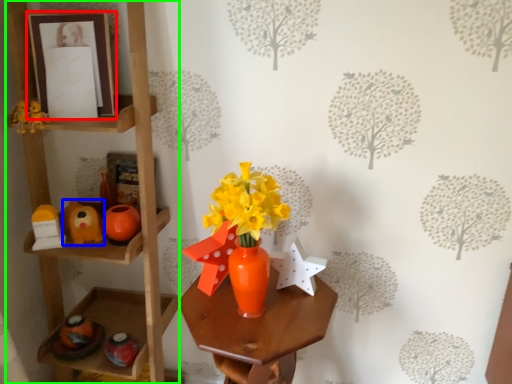
Question: Which object is the closest to the picture frame (highlighted by a red box)? Choose among these: toy (highlighted by a blue box) or shelf (highlighted by a green box).

Choices:
 (A) toy
 (B) shelf

Answer: (B)